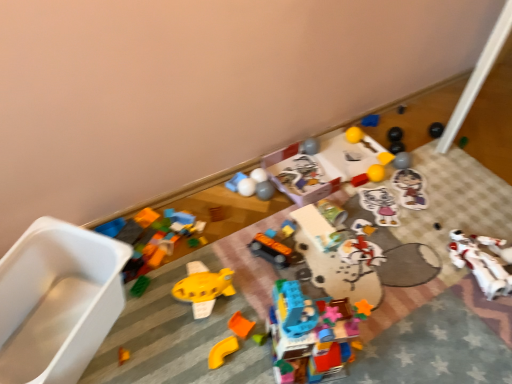
Locate an element on the screen. unoccupied region to the right of yellow matte toy boat at center, positioned as the second toy in left-to-right order is located at coordinates (257, 299).